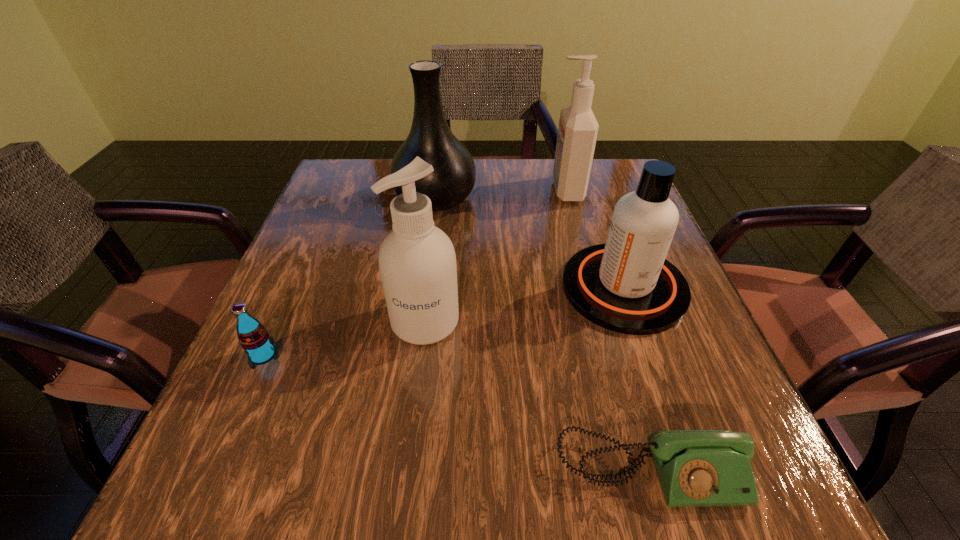
Where is `the farthest cleansing agent`? This screenshot has height=540, width=960. the farthest cleansing agent is located at coordinates (577, 133).

Locate an element on the screen. vase is located at coordinates (430, 138).

Find the location of a particular element. the leftmost cleansing agent is located at coordinates (417, 262).

Find the location of `the shortest cleansing agent`. the shortest cleansing agent is located at coordinates (627, 286).

You are a GUI agent. You are given a task and a screenshot of the screen. Output one action in this format:
    pyautogui.click(x=<x>, y=<y>)
    Task: Click on the fifth tallest object
    The width and height of the screenshot is (960, 540).
    Given the screenshot: What is the action you would take?
    pyautogui.click(x=253, y=337)

The height and width of the screenshot is (540, 960). In order to click on soda in this screenshot , I will do `click(253, 337)`.

I want to click on telephone, so click(696, 468).

This screenshot has height=540, width=960. What are the coordinates of `the nearest object` in the screenshot? It's located at (696, 468).

In order to click on free space located 0.240m on the front label of the farthest cleansing agent in this screenshot , I will do tap(454, 190).

You are a GUI agent. You are given a task and a screenshot of the screen. Output one action in this format:
    pyautogui.click(x=<x>, y=<y>)
    Task: Click on the vacant space situated 0.270m on the front label of the farthest cleansing agent
    
    Given the screenshot: What is the action you would take?
    pyautogui.click(x=442, y=190)